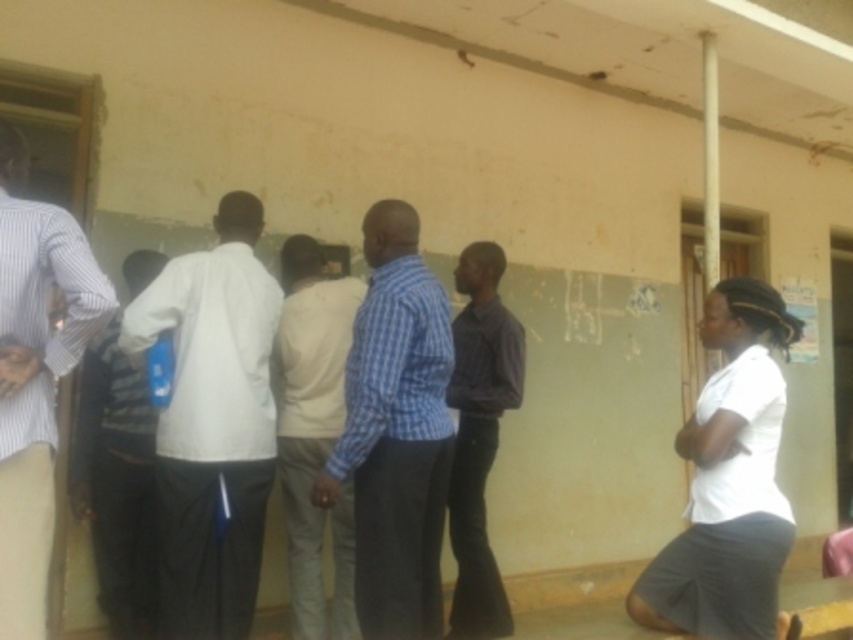
Question: Which object appears farthest from the camera in this image?

Choices:
 (A) striped fabric shirt at left
 (B) blue checkered shirt at center

Answer: (A)

Question: Which object is the farthest from the blue checkered shirt at center?

Choices:
 (A) striped cotton shirt at left
 (B) striped fabric shirt at left

Answer: (B)

Question: Based on their relative distances, which object is nearer to the purple shirt at center?

Choices:
 (A) striped fabric shirt at left
 (B) striped cotton shirt at left
 (C) light beige cotton shirt at center

Answer: (C)

Question: Does blue checkered shirt at center appear on the right side of striped cotton shirt at left?

Choices:
 (A) no
 (B) yes

Answer: (B)

Question: Is white matte shirt at center wider than striped fabric shirt at left?

Choices:
 (A) no
 (B) yes

Answer: (B)

Question: Does striped cotton shirt at left have a larger size compared to purple shirt at center?

Choices:
 (A) no
 (B) yes

Answer: (A)